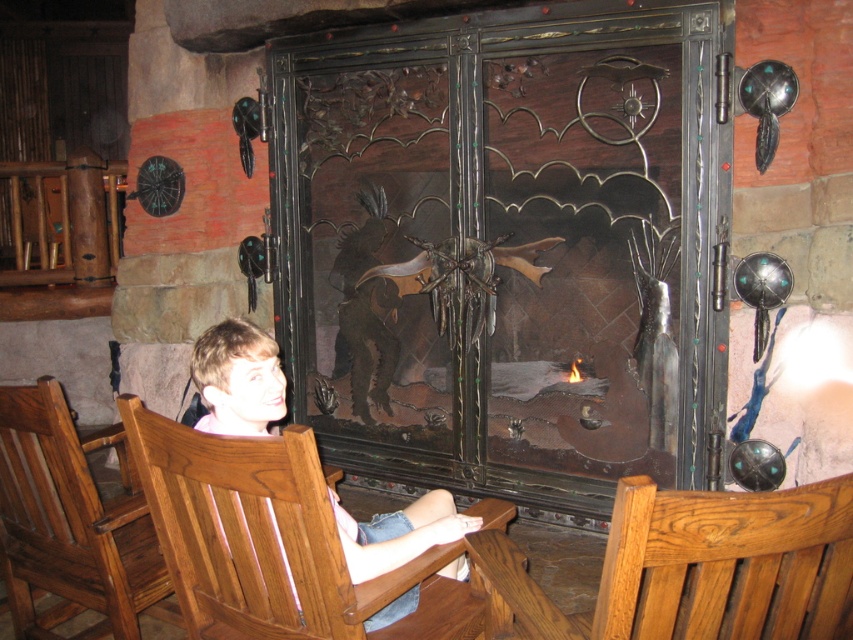
You are designing a seating arrangement for a small gathering in this themed room. You have two chairs available, the brown wood chair at lower left and the light brown wood chair at center. If you want to seat more people, which chair should you choose and why?

You should choose the light brown wood chair at center because the brown wood chair at lower left is wider, meaning fewer of them can fit in the same space compared to the lighter brown one which is narrower. Thus, using the light brown wood chair at center allows seating more people.

You are standing at the center of the room and want to sit down. The brown wood chair at lower left is located at point 0.819, 0.084. Can you walk directly to it without any obstacles?

The brown wood chair at lower left is located at point (71,524), so yes, you can walk directly to it without any obstacles as there are no objects mentioned in the scene blocking the path.

You are standing in the themed room and want to sit down on the light brown wood chair at center. Which direction should you move to reach it from the dark wrought iron fireplace at center?

Since the dark wrought iron fireplace at center is closer to you than the light brown wood chair at center, you should move backward away from the fireplace to reach the chair.